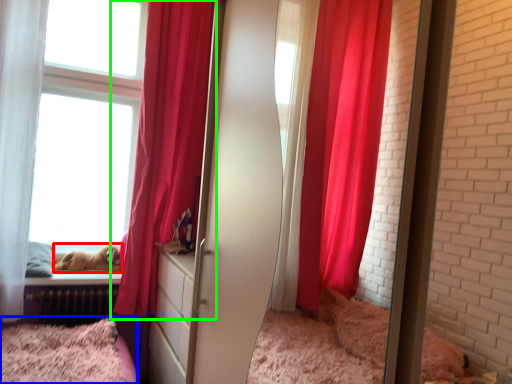
Question: Which is farther away from animal (highlighted by a red box)? bed (highlighted by a blue box) or curtain (highlighted by a green box)?

Choices:
 (A) bed
 (B) curtain

Answer: (B)